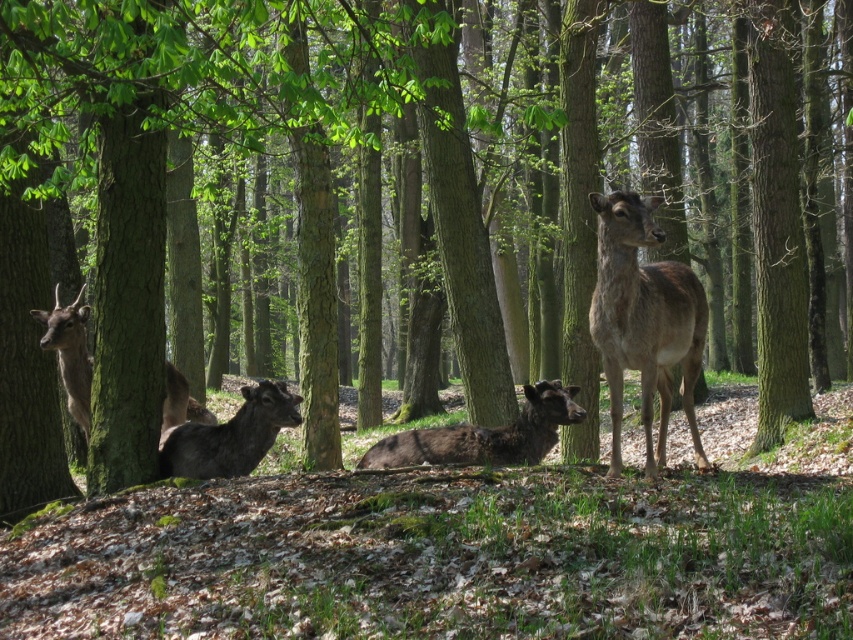
Is point (688, 374) in front of point (198, 417)?

Yes, it is.

Is brown matte/deer at center below brown fur deer at left?

No.

Who is more distant from viewer, (602, 369) or (83, 396)?

The point (602, 369) is more distant.

Identify the location of brown matte/deer at center. click(x=643, y=321).

Is brown matte/deer at center further to the viewer compared to brown fur at center?

No, it is not.

Is brown matte/deer at center wider than brown fur at center?

No.

The width and height of the screenshot is (853, 640). What are the coordinates of `brown matte/deer at center` in the screenshot? It's located at (643, 321).

Measure the distance from brown fur at center to brown fur deer at left.

2.90 meters

Who is shorter, brown fur at center or brown fur deer at left?

Standing shorter between the two is brown fur at center.

Identify the location of brown fur at center. (485, 435).

You are a GUI agent. You are given a task and a screenshot of the screen. Output one action in this format:
    pyautogui.click(x=<x>, y=<y>)
    Task: Click on the brown fur at center
    
    Given the screenshot: What is the action you would take?
    pyautogui.click(x=485, y=435)